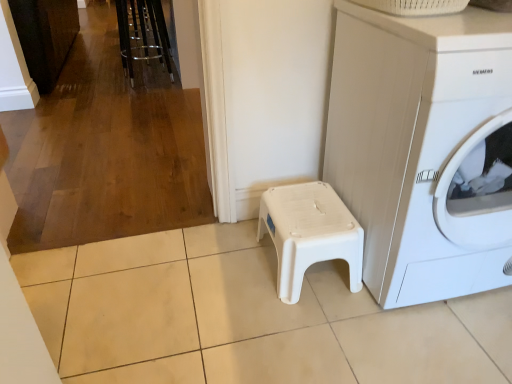
Locate an element on the screen. vacant space to the left of metallic chrome bar stool at upper left is located at coordinates (101, 82).